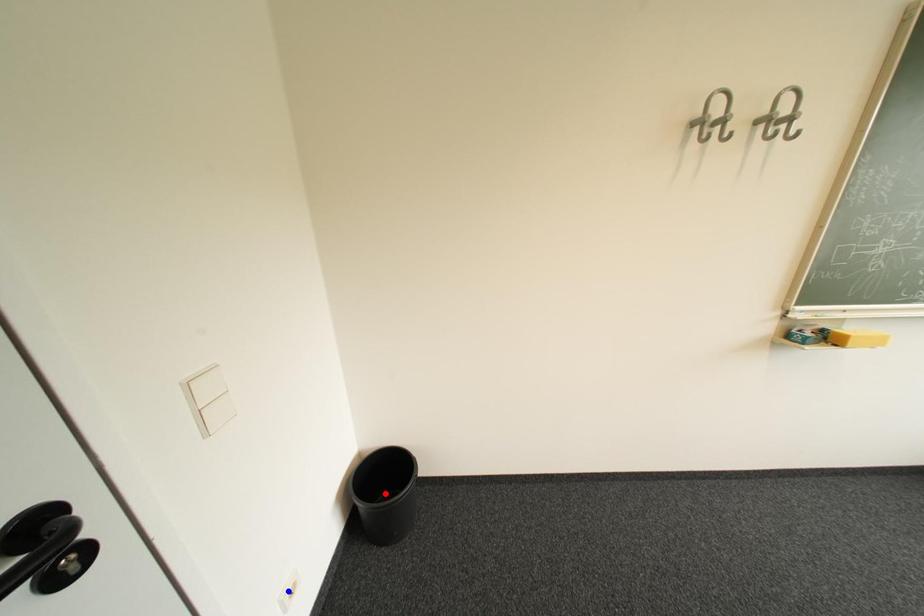
Question: In the image, two points are highlighted. Which point is nearer to the camera? Reply with the corresponding letter.

Choices:
 (A) blue point
 (B) red point

Answer: (A)